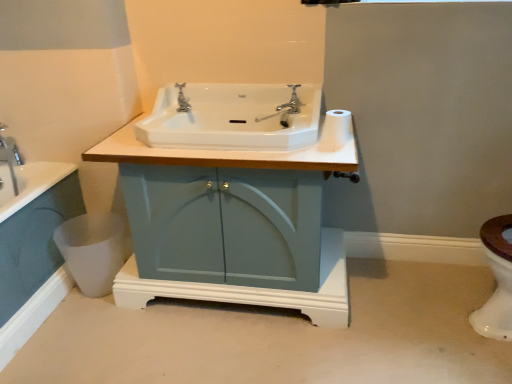
The width and height of the screenshot is (512, 384). Describe the element at coordinates (292, 101) in the screenshot. I see `chrome metallic faucet at upper center` at that location.

Identify the location of matte blue cabinet at center. (253, 288).

Does chrome metallic faucet at upper center appear on the left side of silver metallic faucet at center?

Incorrect, chrome metallic faucet at upper center is not on the left side of silver metallic faucet at center.

Is chrome metallic faucet at upper center next to silver metallic faucet at center and touching it?

No, chrome metallic faucet at upper center is not making contact with silver metallic faucet at center.

From the picture: From the image's perspective, is chrome metallic faucet at upper center located beneath silver metallic faucet at center?

Indeed, from the image's perspective, chrome metallic faucet at upper center is shown beneath silver metallic faucet at center.

Considering the relative sizes of white matte toilet paper at upper right and silver metallic faucet at center in the image provided, is white matte toilet paper at upper right thinner than silver metallic faucet at center?

Indeed, white matte toilet paper at upper right has a lesser width compared to silver metallic faucet at center.

Is point (343, 128) in front of point (183, 110)?

Yes, it is in front of point (183, 110).

From a real-world perspective, is white matte toilet paper at upper right positioned above or below silver metallic faucet at center?

In terms of real-world spatial position, white matte toilet paper at upper right is below silver metallic faucet at center.

Looking at this image, relative to silver metallic faucet at center, is white matte toilet paper at upper right in front or behind?

In the image, white matte toilet paper at upper right appears in front of silver metallic faucet at center.

How many degrees apart are the facing directions of white glossy sink at center and white matte toilet paper at upper right?

They differ by 1.24 degrees in their facing directions.

Who is shorter, white glossy sink at center or white matte toilet paper at upper right?

white matte toilet paper at upper right.

From the image's perspective, between white glossy sink at center and white matte toilet paper at upper right, who is located below?

white matte toilet paper at upper right.

Can you confirm if white glossy sink at center is wider than white matte toilet paper at upper right?

Yes, white glossy sink at center is wider than white matte toilet paper at upper right.

Considering the points (344, 138) and (291, 111), which point is in front, point (344, 138) or point (291, 111)?

The point (344, 138) is in front.

Which object is closer to the camera taking this photo, white matte toilet paper at upper right or chrome metallic faucet at upper center?

white matte toilet paper at upper right is more forward.

From the picture: Between white matte toilet paper at upper right and white glossy sink at center, which one has larger size?

white glossy sink at center is bigger.

Looking at this image, is white matte toilet paper at upper right next to white glossy sink at center?

No, white matte toilet paper at upper right is not beside white glossy sink at center.

Is white glossy sink at center at the back of white matte toilet paper at upper right?

That's not correct — white matte toilet paper at upper right is not looking away from white glossy sink at center.

Find the location of a particular element. This screenshot has width=512, height=384. toilet paper to the right of white glossy sink at center is located at coordinates (337, 127).

Is matte blue cabinet at center wider or thinner than white glossy sink at center?

In the image, matte blue cabinet at center appears to be wider than white glossy sink at center.

In the scene shown: In the image, is matte blue cabinet at center positioned in front of or behind white glossy sink at center?

Visually, matte blue cabinet at center is located in front of white glossy sink at center.

Are matte blue cabinet at center and white glossy sink at center beside each other?

matte blue cabinet at center is not next to white glossy sink at center, and they're not touching.

The image size is (512, 384). There is a matte blue cabinet at center. Find the location of `sink above it (from a real-world perspective)`. sink above it (from a real-world perspective) is located at coordinates (234, 117).

From a real-world perspective, which is physically below, white glossy sink at center or chrome metallic faucet at upper center?

In real-world perspective, white glossy sink at center is lower.

Considering the relative sizes of white glossy sink at center and chrome metallic faucet at upper center in the image provided, is white glossy sink at center taller than chrome metallic faucet at upper center?

Correct, white glossy sink at center is much taller as chrome metallic faucet at upper center.

Which is nearer, (x=267, y=147) or (x=295, y=110)?

Point (x=267, y=147) is closer to the camera than point (x=295, y=110).

From the image's perspective, is white glossy sink at center over chrome metallic faucet at upper center?

No, from the image's perspective, white glossy sink at center is not over chrome metallic faucet at upper center.

The image size is (512, 384). In order to click on tap that is behind the chrome metallic faucet at upper center in this screenshot , I will do `click(182, 99)`.

Locate an element on the screen. This screenshot has height=384, width=512. toilet paper in front of the silver metallic faucet at center is located at coordinates (337, 127).

Based on their spatial positions, is chrome metallic faucet at upper center or white glossy toilet bowl at lower right further from silver metallic faucet at center?

white glossy toilet bowl at lower right lies further to silver metallic faucet at center than the other object.

When comparing their distances from white glossy toilet bowl at lower right, does white matte toilet paper at upper right or matte blue cabinet at center seem further?

Based on the image, white matte toilet paper at upper right appears to be further to white glossy toilet bowl at lower right.

Which object lies nearer to the anchor point chrome metallic faucet at upper center, white glossy toilet bowl at lower right or white glossy sink at center?

white glossy sink at center is positioned closer to the anchor chrome metallic faucet at upper center.

Which object lies nearer to the anchor point matte blue cabinet at center, silver metallic faucet at center or white matte toilet paper at upper right?

white matte toilet paper at upper right lies closer to matte blue cabinet at center than the other object.

Estimate the real-world distances between objects in this image. Which object is closer to white glossy toilet bowl at lower right, chrome metallic faucet at upper center or white glossy sink at center?

The object closer to white glossy toilet bowl at lower right is white glossy sink at center.

Considering their positions, is silver metallic faucet at center positioned closer to white matte toilet paper at upper right than white glossy sink at center?

Among the two, white glossy sink at center is located nearer to white matte toilet paper at upper right.

From the image, which object appears to be farther from white matte toilet paper at upper right, white glossy toilet bowl at lower right or chrome metallic faucet at upper center?

white glossy toilet bowl at lower right is positioned further to the anchor white matte toilet paper at upper right.

Considering their positions, is matte blue cabinet at center positioned further to white matte toilet paper at upper right than chrome metallic faucet at upper center?

matte blue cabinet at center lies further to white matte toilet paper at upper right than the other object.

Where is `sink between silver metallic faucet at center and white glossy toilet bowl at lower right vertically`? The width and height of the screenshot is (512, 384). sink between silver metallic faucet at center and white glossy toilet bowl at lower right vertically is located at coordinates (234, 117).

This screenshot has width=512, height=384. In order to click on sink between chrome metallic faucet at upper center and matte blue cabinet at center in the vertical direction in this screenshot , I will do `click(234, 117)`.

At what (x,y) coordinates should I click in order to perform the action: click on bathroom cabinet between white glossy toilet bowl at lower right and chrome metallic faucet at upper center. Please return your answer as a coordinate pair (x, y). This screenshot has width=512, height=384. Looking at the image, I should click on (253, 288).

The width and height of the screenshot is (512, 384). I want to click on plumbing fixture between white glossy sink at center and white matte toilet paper at upper right, so click(x=292, y=101).